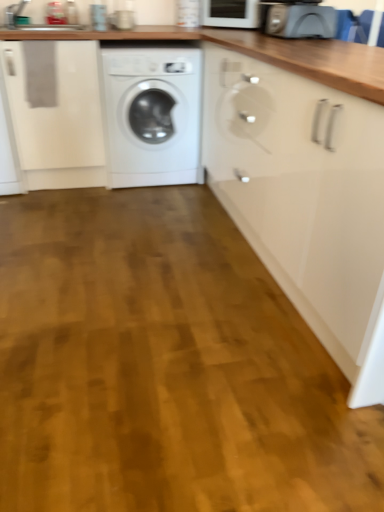
Find the location of a particular element. wooden floor at center is located at coordinates (164, 367).

The image size is (384, 512). I want to click on matte gray toaster at upper right, positioned as the second appliance in back-to-front order, so click(x=298, y=20).

How much space does matte gray toaster at upper right, marked as the 2th appliance in a top-to-bottom arrangement, occupy vertically?

The height of matte gray toaster at upper right, marked as the 2th appliance in a top-to-bottom arrangement, is 7.34 inches.

At what (x,y) coordinates should I click in order to perform the action: click on white glossy washing machine at center. Please return your answer as a coordinate pair (x, y). This screenshot has height=512, width=384. Looking at the image, I should click on (151, 115).

This screenshot has width=384, height=512. Find the location of `glossy white cabinet at center`. glossy white cabinet at center is located at coordinates (305, 199).

Find the location of `wooden floor at center`. wooden floor at center is located at coordinates (164, 367).

Find the location of a particular element. washing machine on the left side of wooden floor at center is located at coordinates (151, 115).

Visually, is wooden floor at center positioned to the left or to the right of white glossy washing machine at center?

wooden floor at center is positioned on white glossy washing machine at center's right side.

Is wooden floor at center positioned far away from white glossy washing machine at center?

Absolutely, wooden floor at center is distant from white glossy washing machine at center.

Based on the photo, from the image's perspective, is wooden floor at center positioned above or below white glossy washing machine at center?

Based on their image positions, wooden floor at center is located beneath white glossy washing machine at center.

How much distance is there between glossy white cabinet at center and wooden counter at upper center?

The distance of glossy white cabinet at center from wooden counter at upper center is 3.33 inches.

Is glossy white cabinet at center oriented towards wooden counter at upper center?

Yes, glossy white cabinet at center is turned towards wooden counter at upper center.

From the image's perspective, which is above, glossy white cabinet at center or wooden counter at upper center?

→ glossy white cabinet at center.

Based on the photo, can you tell me how much glossy white cabinet at center and wooden counter at upper center differ in facing direction?

There is a 180-degree angle between the facing directions of glossy white cabinet at center and wooden counter at upper center.

From a real-world perspective, is white glossy washing machine at center located higher than matte gray toaster at upper right, marked as the first appliance in a front-to-back arrangement?

No, from a real-world perspective, white glossy washing machine at center is not on top of matte gray toaster at upper right, marked as the first appliance in a front-to-back arrangement.

Which object is thinner, white glossy washing machine at center or matte gray toaster at upper right, marked as the first appliance in a front-to-back arrangement?

Thinner between the two is matte gray toaster at upper right, marked as the first appliance in a front-to-back arrangement.

Is white glossy washing machine at center oriented towards matte gray toaster at upper right, positioned as the second appliance in back-to-front order?

No, white glossy washing machine at center is not facing towards matte gray toaster at upper right, positioned as the second appliance in back-to-front order.

What's the angular difference between white glossy washing machine at center and matte gray toaster at upper right, which is counted as the first appliance, starting from the bottom,'s facing directions?

There is a 89.1-degree angle between the facing directions of white glossy washing machine at center and matte gray toaster at upper right, which is counted as the first appliance, starting from the bottom.

Is matte gray toaster at upper right, positioned as the second appliance in back-to-front order, to the right of glossy white cabinet at center from the viewer's perspective?

Correct, you'll find matte gray toaster at upper right, positioned as the second appliance in back-to-front order, to the right of glossy white cabinet at center.

How many degrees apart are the facing directions of matte gray toaster at upper right, positioned as the second appliance in back-to-front order, and glossy white cabinet at center?

The angle between the facing direction of matte gray toaster at upper right, positioned as the second appliance in back-to-front order, and the facing direction of glossy white cabinet at center is 3.04e-05 degrees.

Considering the relative sizes of matte gray toaster at upper right, marked as the first appliance in a front-to-back arrangement, and glossy white cabinet at center in the image provided, is matte gray toaster at upper right, marked as the first appliance in a front-to-back arrangement, wider than glossy white cabinet at center?

In fact, matte gray toaster at upper right, marked as the first appliance in a front-to-back arrangement, might be narrower than glossy white cabinet at center.

From a real-world perspective, which object rests below the other?

glossy white cabinet at center, from a real-world perspective.

Is glossy white cabinet at center with wooden floor at center?

No.

From a real-world perspective, is glossy white cabinet at center positioned above or below wooden floor at center?

Clearly, from a real-world perspective, glossy white cabinet at center is above wooden floor at center.

Is glossy white cabinet at center to the right of wooden floor at center from the viewer's perspective?

Yes.

In the scene shown: In terms of width, does glossy white cabinet at center look wider or thinner when compared to wooden floor at center?

In the image, glossy white cabinet at center appears to be more narrow than wooden floor at center.

The height and width of the screenshot is (512, 384). I want to click on cabinetry lying below the white glossy washing machine at center (from the image's perspective), so click(305, 199).

Is point (288, 141) positioned behind point (184, 169)?

No, it is in front of (184, 169).

Is glossy white cabinet at center shorter than white glossy washing machine at center?

Incorrect, the height of glossy white cabinet at center does not fall short of that of white glossy washing machine at center.

From a real-world perspective, between wooden floor at center and wooden counter at upper center, who is vertically lower?

wooden floor at center is physically lower.

Are wooden floor at center and wooden counter at upper center making contact?

wooden floor at center is not next to wooden counter at upper center, and they're not touching.

Find the location of a particular element. This screenshot has height=512, width=384. counter located above the wooden floor at center (from the image's perspective) is located at coordinates (297, 175).

At what (x,y) coordinates should I click in order to perform the action: click on washing machine lying on the left of wooden floor at center. Please return your answer as a coordinate pair (x, y). The image size is (384, 512). Looking at the image, I should click on (151, 115).

This screenshot has height=512, width=384. In order to click on cabinetry on the right of wooden counter at upper center in this screenshot , I will do `click(305, 199)`.

Which object lies further to the anchor point matte gray toaster at upper right, which is counted as the first appliance, starting from the bottom, wooden counter at upper center or white glossy washing machine at center?

The object further to matte gray toaster at upper right, which is counted as the first appliance, starting from the bottom, is wooden counter at upper center.

Based on their spatial positions, is white glossy microwave at upper center, positioned as the first appliance in back-to-front order, or glossy white cabinet at center closer to matte gray toaster at upper right, positioned as the second appliance in back-to-front order?

white glossy microwave at upper center, positioned as the first appliance in back-to-front order.

Considering their positions, is wooden counter at upper center positioned further to matte gray toaster at upper right, positioned as the second appliance in back-to-front order, than glossy white cabinet at center?

glossy white cabinet at center.

Based on their spatial positions, is wooden counter at upper center or wooden floor at center closer to white glossy washing machine at center?

Among the two, wooden counter at upper center is located nearer to white glossy washing machine at center.

Considering their positions, is matte gray toaster at upper right, which is counted as the first appliance, starting from the bottom, positioned closer to glossy white cabinet at center than white glossy microwave at upper center, positioned as the first appliance in back-to-front order?

Based on the image, matte gray toaster at upper right, which is counted as the first appliance, starting from the bottom, appears to be nearer to glossy white cabinet at center.

Looking at the image, which one is located closer to wooden floor at center, white glossy microwave at upper center, the 1th appliance when ordered from top to bottom, or glossy white cabinet at center?

glossy white cabinet at center is closer to wooden floor at center.

Based on their spatial positions, is white glossy washing machine at center or glossy white cabinet at center further from white glossy microwave at upper center, positioned as the second appliance in bottom-to-top order?

glossy white cabinet at center lies further to white glossy microwave at upper center, positioned as the second appliance in bottom-to-top order, than the other object.

Considering their positions, is wooden counter at upper center positioned further to white glossy washing machine at center than glossy white cabinet at center?

glossy white cabinet at center is further to white glossy washing machine at center.

Locate an element on the screen. The height and width of the screenshot is (512, 384). washing machine between wooden floor at center and white glossy microwave at upper center, the second appliance when ordered from front to back, from front to back is located at coordinates (151, 115).

Where is `appliance between glossy white cabinet at center and white glossy microwave at upper center, positioned as the first appliance in back-to-front order, from front to back`? appliance between glossy white cabinet at center and white glossy microwave at upper center, positioned as the first appliance in back-to-front order, from front to back is located at coordinates (298, 20).

Where is `appliance positioned between wooden floor at center and white glossy washing machine at center from near to far`? appliance positioned between wooden floor at center and white glossy washing machine at center from near to far is located at coordinates (298, 20).

At what (x,y) coordinates should I click in order to perform the action: click on washing machine between glossy white cabinet at center and white glossy microwave at upper center, positioned as the first appliance in back-to-front order, along the z-axis. Please return your answer as a coordinate pair (x, y). Looking at the image, I should click on (151, 115).